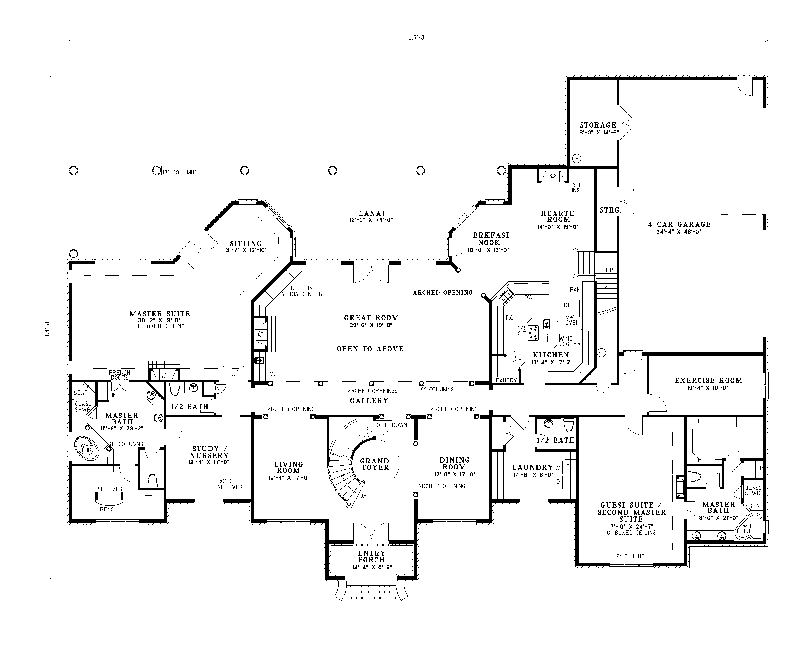
Identify the location of guest suite. (577, 415), (680, 417), (682, 561), (580, 559).